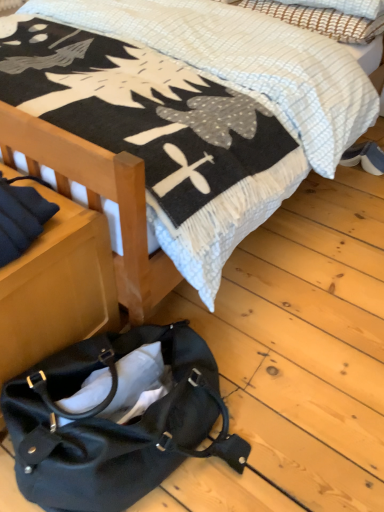
Question: Is blue suede shoes at lower right far from soft cotton blanket at upper center?

Choices:
 (A) no
 (B) yes

Answer: (A)

Question: Does blue suede shoes at lower right appear on the left side of soft cotton blanket at upper center?

Choices:
 (A) no
 (B) yes

Answer: (A)

Question: Can you confirm if blue suede shoes at lower right is shorter than soft cotton blanket at upper center?

Choices:
 (A) yes
 (B) no

Answer: (A)

Question: Can you confirm if blue suede shoes at lower right is positioned to the right of soft cotton blanket at upper center?

Choices:
 (A) yes
 (B) no

Answer: (A)

Question: From a real-world perspective, is blue suede shoes at lower right under soft cotton blanket at upper center?

Choices:
 (A) yes
 (B) no

Answer: (A)

Question: Based on their positions, is matte black handbag at lower left located to the left or right of blue suede shoes at lower right?

Choices:
 (A) left
 (B) right

Answer: (A)

Question: From a real-world perspective, relative to blue suede shoes at lower right, is matte black handbag at lower left vertically above or below?

Choices:
 (A) above
 (B) below

Answer: (A)

Question: Considering the positions of matte black handbag at lower left and blue suede shoes at lower right in the image, is matte black handbag at lower left wider or thinner than blue suede shoes at lower right?

Choices:
 (A) thin
 (B) wide

Answer: (B)

Question: Considering the positions of point (44, 467) and point (352, 145), is point (44, 467) closer or farther from the camera than point (352, 145)?

Choices:
 (A) farther
 (B) closer

Answer: (B)

Question: From the image's perspective, relative to woven fabric pillow at upper right, is soft cotton blanket at upper center above or below?

Choices:
 (A) above
 (B) below

Answer: (B)

Question: In terms of width, does soft cotton blanket at upper center look wider or thinner when compared to woven fabric pillow at upper right?

Choices:
 (A) wide
 (B) thin

Answer: (A)

Question: From a real-world perspective, is soft cotton blanket at upper center above or below woven fabric pillow at upper right?

Choices:
 (A) above
 (B) below

Answer: (B)

Question: Looking at the image, does soft cotton blanket at upper center seem bigger or smaller compared to woven fabric pillow at upper right?

Choices:
 (A) big
 (B) small

Answer: (A)

Question: Is woven fabric pillow at upper right inside the boundaries of blue suede shoes at lower right, or outside?

Choices:
 (A) inside
 (B) outside

Answer: (B)

Question: Considering the positions of woven fabric pillow at upper right and blue suede shoes at lower right in the image, is woven fabric pillow at upper right wider or thinner than blue suede shoes at lower right?

Choices:
 (A) wide
 (B) thin

Answer: (A)